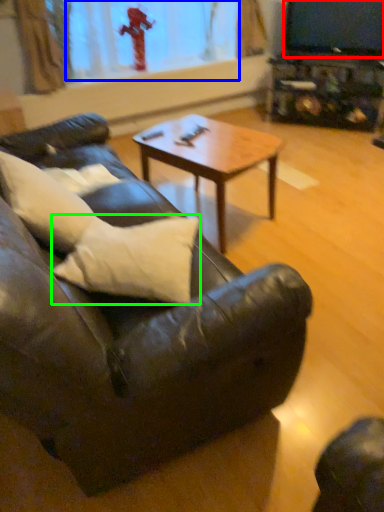
Question: Which object is positioned closest to television (highlighted by a red box)? Select from window screen (highlighted by a blue box) and pillow (highlighted by a green box).

Choices:
 (A) window screen
 (B) pillow

Answer: (A)